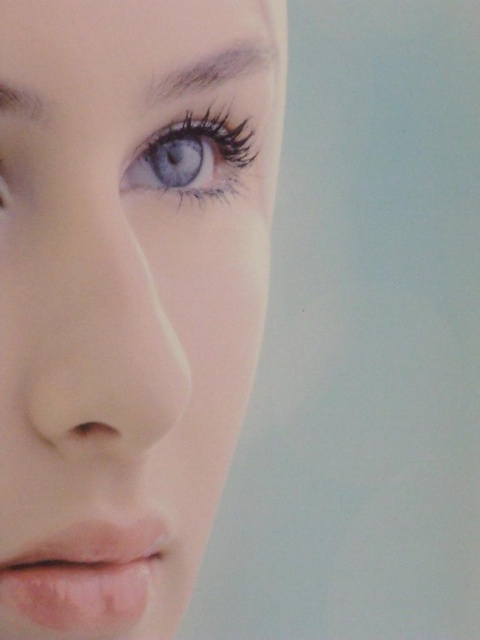
Does smooth skin nose at center have a greater height compared to gray matte eyebrow at upper left?

Indeed, smooth skin nose at center has a greater height compared to gray matte eyebrow at upper left.

In the scene shown: Does smooth skin nose at center have a lesser height compared to gray matte eyebrow at upper left?

Incorrect, smooth skin nose at center's height does not fall short of gray matte eyebrow at upper left's.

Locate an element on the screen. Image resolution: width=480 pixels, height=640 pixels. smooth skin nose at center is located at coordinates (100, 339).

Locate an element on the screen. smooth skin face at upper left is located at coordinates click(x=127, y=296).

Is smooth skin face at upper left below gray matte eyebrow at upper left?

Correct, smooth skin face at upper left is located below gray matte eyebrow at upper left.

Is point (47, 237) farther from camera compared to point (248, 45)?

No, (47, 237) is in front of (248, 45).

At what (x,y) coordinates should I click in order to perform the action: click on smooth skin face at upper left. Please return your answer as a coordinate pair (x, y). Looking at the image, I should click on (127, 296).

Who is shorter, pale matte lips at lower left or gray matte eyebrow at upper left?

With less height is gray matte eyebrow at upper left.

The width and height of the screenshot is (480, 640). Describe the element at coordinates (84, 579) in the screenshot. I see `pale matte lips at lower left` at that location.

Find the location of a particular element. This screenshot has width=480, height=640. pale matte lips at lower left is located at coordinates (84, 579).